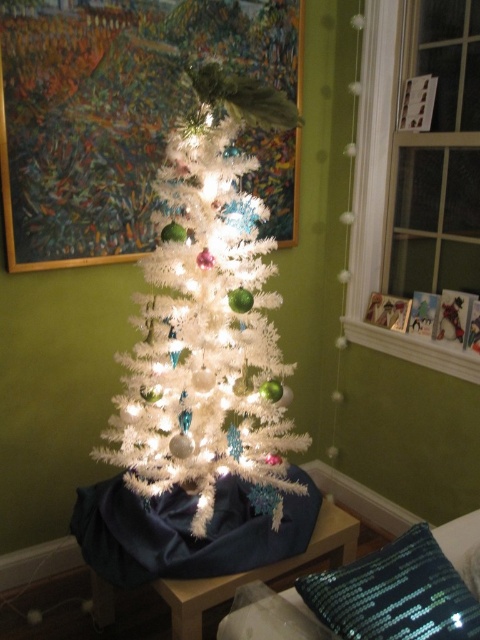
Question: Among these objects, which one is nearest to the camera?

Choices:
 (A) sparkly sequined pillow at lower right
 (B) painted wood picture frame at upper center

Answer: (A)

Question: Among these objects, which one is farthest from the camera?

Choices:
 (A) white fluffy christmas tree at center
 (B) painted wood picture frame at upper center
 (C) sparkly sequined pillow at lower right

Answer: (B)

Question: Can you confirm if painted wood picture frame at upper center is wider than white fluffy christmas tree at center?

Choices:
 (A) no
 (B) yes

Answer: (B)

Question: Can you confirm if painted wood picture frame at upper center is positioned above sparkly sequined pillow at lower right?

Choices:
 (A) no
 (B) yes

Answer: (B)

Question: Based on their relative distances, which object is farther from the white fluffy christmas tree at center?

Choices:
 (A) sparkly sequined pillow at lower right
 (B) painted wood picture frame at upper center

Answer: (A)

Question: Observing the image, what is the correct spatial positioning of white fluffy christmas tree at center in reference to sparkly sequined pillow at lower right?

Choices:
 (A) above
 (B) below

Answer: (A)